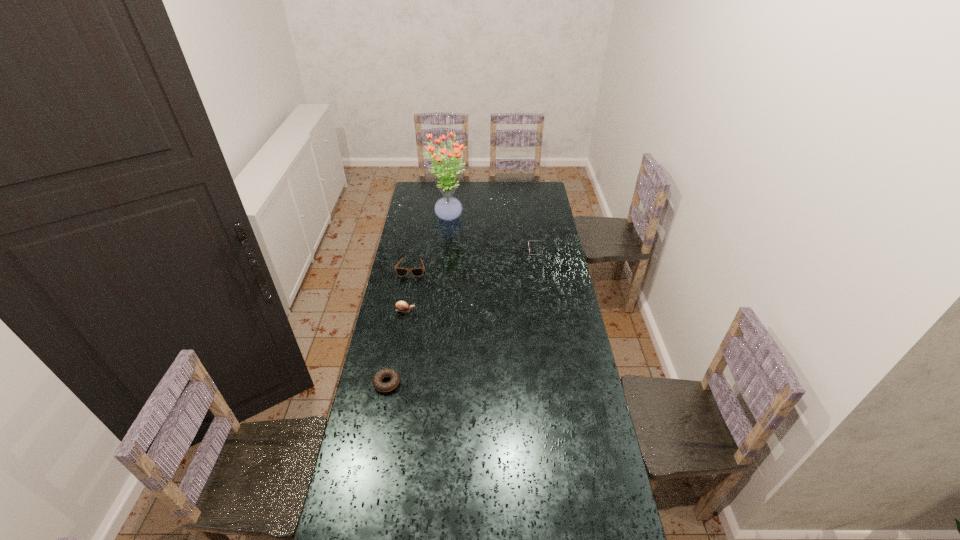
I want to click on object located in the right edge section of the desktop, so click(x=528, y=241).

The image size is (960, 540). Find the location of `vacant space at the far edge of the desktop`. vacant space at the far edge of the desktop is located at coordinates (490, 198).

In the image, there is a desktop. Where is `vacant space at the left edge`? This screenshot has height=540, width=960. vacant space at the left edge is located at coordinates (410, 381).

What are the coordinates of `free space at the right edge of the desktop` in the screenshot? It's located at click(540, 212).

At what (x,y) coordinates should I click in order to perform the action: click on vacant space at the far right corner of the desktop. Please return your answer as a coordinate pair (x, y). Image resolution: width=960 pixels, height=540 pixels. Looking at the image, I should click on (544, 186).

Where is `vacant area that lies between the fourth farthest object and the farthest object`? Image resolution: width=960 pixels, height=540 pixels. vacant area that lies between the fourth farthest object and the farthest object is located at coordinates (x=426, y=264).

Identify the location of free spot between the nearest object and the flower arrangement. The width and height of the screenshot is (960, 540). (418, 300).

The width and height of the screenshot is (960, 540). I want to click on vacant space in between the rightmost object and the doughnut, so click(464, 317).

Locate an element on the screen. Image resolution: width=960 pixels, height=540 pixels. free spot between the doughnut and the left sunglasses is located at coordinates (399, 326).

Find the location of a particular element. The image size is (960, 540). free area in between the nearer sunglasses and the doughnut is located at coordinates (399, 326).